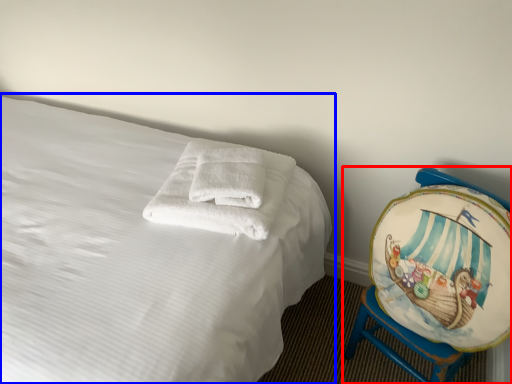
Question: Which object appears farthest to the camera in this image, furniture (highlighted by a red box) or bed (highlighted by a blue box)?

Choices:
 (A) furniture
 (B) bed

Answer: (A)